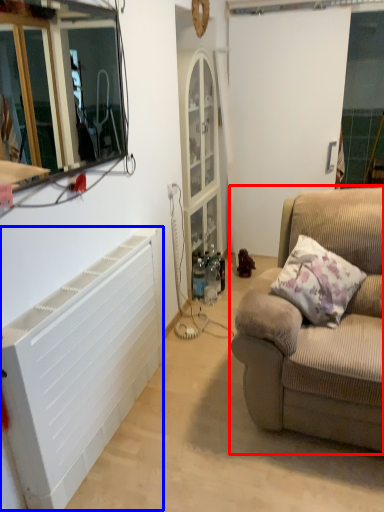
Question: Which point is further to the camera, studio couch (highlighted by a red box) or air conditioning (highlighted by a blue box)?

Choices:
 (A) studio couch
 (B) air conditioning

Answer: (A)